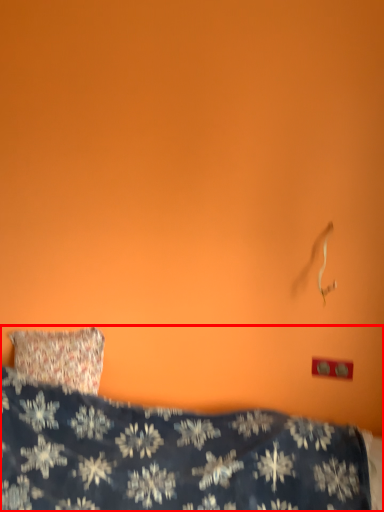
Question: In this image, where is bed (annotated by the red box) located relative to electric outlet?

Choices:
 (A) left
 (B) right

Answer: (A)